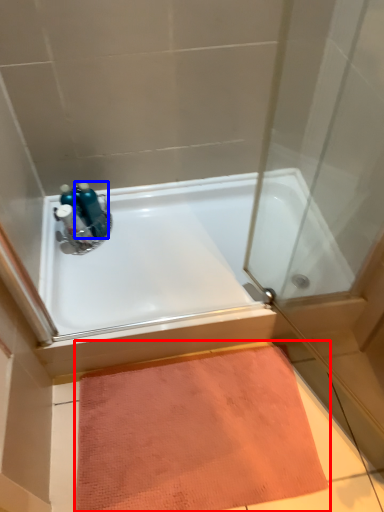
Question: Which object is further to the camera taking this photo, doormat (highlighted by a red box) or bottle (highlighted by a blue box)?

Choices:
 (A) doormat
 (B) bottle

Answer: (B)